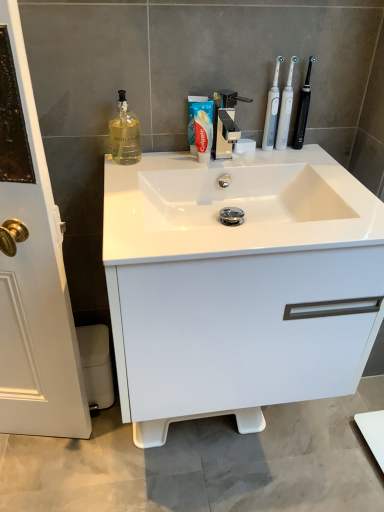
Locate an element on the screen. This screenshot has height=512, width=384. free space to the left of black plastic toothbrush at upper right, the third toothbrush in the left-to-right sequence is located at coordinates (246, 158).